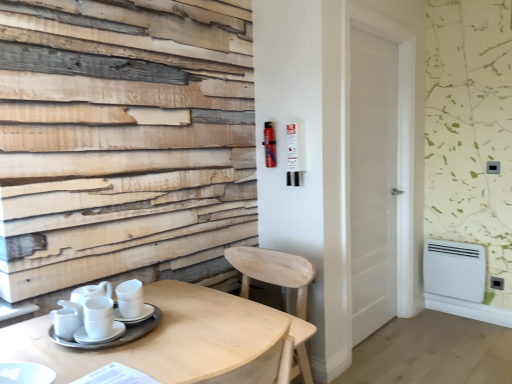
This screenshot has width=512, height=384. I want to click on vacant space in front of white glossy cups at lower left, so click(x=47, y=359).